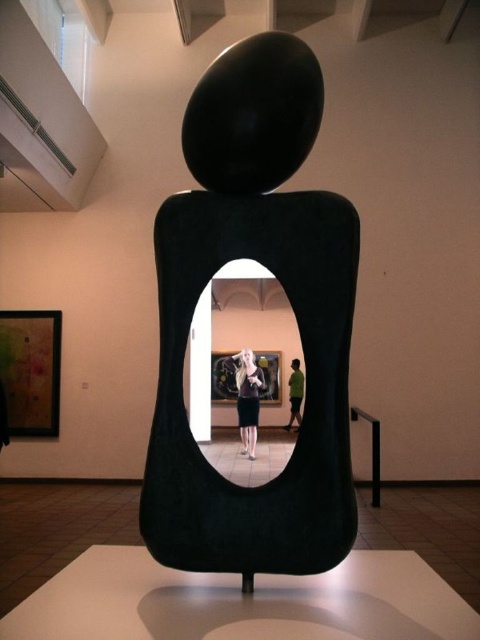
From the picture: You are an art critic standing in the gallery. You notice the black matte sculpture at center and the green matte shirt at center. Which object is taller?

The black matte sculpture at center is taller than the green matte shirt at center.

Based on the photo, you are standing in the gallery and want to touch the point at coordinates point (x=187, y=291) on the sculpture. If your arm can reach up to 1.5 meters, can you reach it?

The distance of point (x=187, y=291) from viewer is 1.67 meters, so no, you cannot reach it since it is further away than your arm can extend.